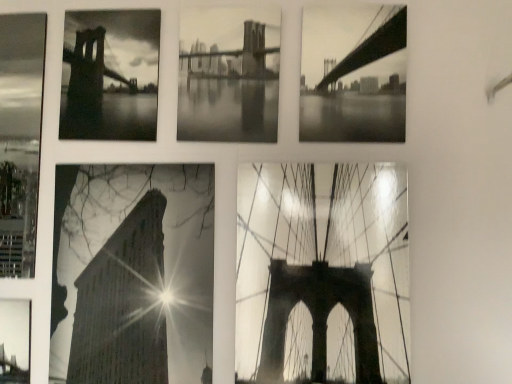
I want to click on monochrome paper brooklyn bridge at center, the fourth picture frame in the left-to-right sequence, so click(229, 74).

In order to face high contrast paper building at bottom left, the 4th picture frame in the right-to-left sequence, should I rotate leftwards or rightwards?

It's best to rotate left around 15.749 degrees.

I want to click on matte glass bridge at center, which is the 5th picture frame in left-to-right order, so click(x=322, y=273).

Identify the location of monochrome bridge at upper right, arranged as the 1th picture frame when viewed from the right. (354, 74).

Is matte glass bridge at center, which is the 5th picture frame in left-to-right order, facing away from monochrome paper brooklyn bridge at center, the fourth picture frame in the left-to-right sequence?

No, matte glass bridge at center, which is the 5th picture frame in left-to-right order,'s orientation is not away from monochrome paper brooklyn bridge at center, the fourth picture frame in the left-to-right sequence.

Between matte glass bridge at center, acting as the 2th picture frame starting from the right, and monochrome paper brooklyn bridge at center, the fourth picture frame in the left-to-right sequence, which one appears on the right side from the viewer's perspective?

matte glass bridge at center, acting as the 2th picture frame starting from the right.

Are matte glass bridge at center, acting as the 2th picture frame starting from the right, and monochrome paper brooklyn bridge at center, the fourth picture frame in the left-to-right sequence, beside each other?

matte glass bridge at center, acting as the 2th picture frame starting from the right, and monochrome paper brooklyn bridge at center, the fourth picture frame in the left-to-right sequence, are not in contact.

Which of these two, matte glass bridge at center, which is the 5th picture frame in left-to-right order, or monochrome paper brooklyn bridge at center, the fourth picture frame in the left-to-right sequence, is smaller?

With smaller size is monochrome paper brooklyn bridge at center, the fourth picture frame in the left-to-right sequence.

From the image's perspective, between metallic bridge at bottom left, which ranks as the first picture frame in left-to-right order, and monochrome bridge at upper right, arranged as the 1th picture frame when viewed from the right, which one is located above?

monochrome bridge at upper right, arranged as the 1th picture frame when viewed from the right, from the image's perspective.

Is metallic bridge at bottom left, which is the 6th picture frame in right-to-left order, completely or partially outside of monochrome bridge at upper right, arranged as the 1th picture frame when viewed from the right?

metallic bridge at bottom left, which is the 6th picture frame in right-to-left order, lies outside monochrome bridge at upper right, arranged as the 1th picture frame when viewed from the right,'s area.

Considering their positions, is metallic bridge at bottom left, which is the 6th picture frame in right-to-left order, located in front of or behind monochrome bridge at upper right, arranged as the 1th picture frame when viewed from the right?

Visually, metallic bridge at bottom left, which is the 6th picture frame in right-to-left order, is located behind monochrome bridge at upper right, arranged as the 1th picture frame when viewed from the right.

Is point (346, 64) positioned after point (226, 45)?

No, it is in front of (226, 45).

Is monochrome bridge at upper right, arranged as the 1th picture frame when viewed from the right, in front of or behind monochrome paper brooklyn bridge at center, marked as the 3th picture frame in a right-to-left arrangement, in the image?

Clearly, monochrome bridge at upper right, arranged as the 1th picture frame when viewed from the right, is in front of monochrome paper brooklyn bridge at center, marked as the 3th picture frame in a right-to-left arrangement.

Between monochrome bridge at upper right, arranged as the 1th picture frame when viewed from the right, and monochrome paper brooklyn bridge at center, marked as the 3th picture frame in a right-to-left arrangement, which one has smaller size?

Smaller between the two is monochrome bridge at upper right, arranged as the 1th picture frame when viewed from the right.

From the image's perspective, who appears lower, monochrome bridge at upper right, the sixth picture frame in the left-to-right sequence, or monochrome paper brooklyn bridge at center, marked as the 3th picture frame in a right-to-left arrangement?

monochrome bridge at upper right, the sixth picture frame in the left-to-right sequence, from the image's perspective.

From the image's perspective, which is below, matte glass bridge at center, acting as the 2th picture frame starting from the right, or monochrome bridge at upper left, positioned as the 5th picture frame in right-to-left order?

matte glass bridge at center, acting as the 2th picture frame starting from the right, is shown below in the image.

Which is behind, matte glass bridge at center, acting as the 2th picture frame starting from the right, or monochrome bridge at upper left, positioned as the 5th picture frame in right-to-left order?

Positioned behind is monochrome bridge at upper left, positioned as the 5th picture frame in right-to-left order.

Consider the image. Does matte glass bridge at center, which is the 5th picture frame in left-to-right order, have a smaller size compared to monochrome bridge at upper left, which is the 2th picture frame in left-to-right order?

No.

Between metallic bridge at bottom left, which is the 6th picture frame in right-to-left order, and monochrome bridge at upper left, positioned as the 5th picture frame in right-to-left order, which one has smaller size?

With smaller size is metallic bridge at bottom left, which is the 6th picture frame in right-to-left order.

How far apart are metallic bridge at bottom left, which ranks as the first picture frame in left-to-right order, and monochrome bridge at upper left, which is the 2th picture frame in left-to-right order?

metallic bridge at bottom left, which ranks as the first picture frame in left-to-right order, is 22.25 inches away from monochrome bridge at upper left, which is the 2th picture frame in left-to-right order.

From the image's perspective, which object appears higher, metallic bridge at bottom left, which is the 6th picture frame in right-to-left order, or monochrome bridge at upper left, positioned as the 5th picture frame in right-to-left order?

monochrome bridge at upper left, positioned as the 5th picture frame in right-to-left order, appears higher in the image.

Can you confirm if metallic bridge at bottom left, which ranks as the first picture frame in left-to-right order, is positioned to the left of monochrome bridge at upper left, positioned as the 5th picture frame in right-to-left order?

Yes.

In the scene shown: Could you measure the distance between high contrast paper building at bottom left, the 4th picture frame in the right-to-left sequence, and metallic bridge at bottom left, which ranks as the first picture frame in left-to-right order?

high contrast paper building at bottom left, the 4th picture frame in the right-to-left sequence, and metallic bridge at bottom left, which ranks as the first picture frame in left-to-right order, are 10.20 inches apart from each other.

Does high contrast paper building at bottom left, the 4th picture frame in the right-to-left sequence, have a larger size compared to metallic bridge at bottom left, which is the 6th picture frame in right-to-left order?

Indeed, high contrast paper building at bottom left, the 4th picture frame in the right-to-left sequence, has a larger size compared to metallic bridge at bottom left, which is the 6th picture frame in right-to-left order.

Could you tell me if high contrast paper building at bottom left, the 4th picture frame in the right-to-left sequence, is facing metallic bridge at bottom left, which is the 6th picture frame in right-to-left order?

No, high contrast paper building at bottom left, the 4th picture frame in the right-to-left sequence, is not turned towards metallic bridge at bottom left, which is the 6th picture frame in right-to-left order.

From a real-world perspective, does high contrast paper building at bottom left, the 3th picture frame in the left-to-right sequence, sit lower than metallic bridge at bottom left, which ranks as the first picture frame in left-to-right order?

No, from a real-world perspective, high contrast paper building at bottom left, the 3th picture frame in the left-to-right sequence, is not under metallic bridge at bottom left, which ranks as the first picture frame in left-to-right order.

Between high contrast paper building at bottom left, the 4th picture frame in the right-to-left sequence, and monochrome bridge at upper left, which is the 2th picture frame in left-to-right order, which one is positioned in front?

Positioned in front is high contrast paper building at bottom left, the 4th picture frame in the right-to-left sequence.

How far apart are high contrast paper building at bottom left, the 3th picture frame in the left-to-right sequence, and monochrome bridge at upper left, positioned as the 5th picture frame in right-to-left order?

high contrast paper building at bottom left, the 3th picture frame in the left-to-right sequence, is 11.29 inches away from monochrome bridge at upper left, positioned as the 5th picture frame in right-to-left order.

Would you say high contrast paper building at bottom left, the 4th picture frame in the right-to-left sequence, is outside monochrome bridge at upper left, positioned as the 5th picture frame in right-to-left order?

Yes, high contrast paper building at bottom left, the 4th picture frame in the right-to-left sequence, is not within monochrome bridge at upper left, positioned as the 5th picture frame in right-to-left order.

Which object is positioned more to the left, high contrast paper building at bottom left, the 4th picture frame in the right-to-left sequence, or monochrome bridge at upper left, which is the 2th picture frame in left-to-right order?

From the viewer's perspective, monochrome bridge at upper left, which is the 2th picture frame in left-to-right order, appears more on the left side.

At what (x,y) coordinates should I click in order to perform the action: click on the 1st picture frame to the left when counting from the matte glass bridge at center, which is the 5th picture frame in left-to-right order. Please return your answer as a coordinate pair (x, y). The width and height of the screenshot is (512, 384). Looking at the image, I should click on (229, 74).

The width and height of the screenshot is (512, 384). Identify the location of the 5th picture frame positioned below the monochrome bridge at upper right, the sixth picture frame in the left-to-right sequence (from a real-world perspective). (15, 341).

Estimate the real-world distances between objects in this image. Which object is closer to monochrome bridge at upper left, positioned as the 5th picture frame in right-to-left order, monochrome paper brooklyn bridge at center, marked as the 3th picture frame in a right-to-left arrangement, or high contrast paper building at bottom left, the 3th picture frame in the left-to-right sequence?

Among the two, monochrome paper brooklyn bridge at center, marked as the 3th picture frame in a right-to-left arrangement, is located nearer to monochrome bridge at upper left, positioned as the 5th picture frame in right-to-left order.

Based on their spatial positions, is metallic bridge at bottom left, which ranks as the first picture frame in left-to-right order, or monochrome bridge at upper right, arranged as the 1th picture frame when viewed from the right, further from monochrome paper brooklyn bridge at center, the fourth picture frame in the left-to-right sequence?

Based on the image, metallic bridge at bottom left, which ranks as the first picture frame in left-to-right order, appears to be further to monochrome paper brooklyn bridge at center, the fourth picture frame in the left-to-right sequence.

Which object lies nearer to the anchor point matte glass bridge at center, acting as the 2th picture frame starting from the right, high contrast paper building at bottom left, the 3th picture frame in the left-to-right sequence, or monochrome bridge at upper left, positioned as the 5th picture frame in right-to-left order?

high contrast paper building at bottom left, the 3th picture frame in the left-to-right sequence, is positioned closer to the anchor matte glass bridge at center, acting as the 2th picture frame starting from the right.

Which object lies further to the anchor point metallic bridge at bottom left, which is the 6th picture frame in right-to-left order, monochrome bridge at upper right, the sixth picture frame in the left-to-right sequence, or high contrast paper building at bottom left, the 3th picture frame in the left-to-right sequence?

Based on the image, monochrome bridge at upper right, the sixth picture frame in the left-to-right sequence, appears to be further to metallic bridge at bottom left, which is the 6th picture frame in right-to-left order.

Which object lies further to the anchor point monochrome paper brooklyn bridge at center, the fourth picture frame in the left-to-right sequence, monochrome bridge at upper left, which is the 2th picture frame in left-to-right order, or monochrome bridge at upper right, arranged as the 1th picture frame when viewed from the right?

monochrome bridge at upper right, arranged as the 1th picture frame when viewed from the right.

From the image, which object appears to be nearer to monochrome bridge at upper right, the sixth picture frame in the left-to-right sequence, matte glass bridge at center, which is the 5th picture frame in left-to-right order, or high contrast paper building at bottom left, the 4th picture frame in the right-to-left sequence?

matte glass bridge at center, which is the 5th picture frame in left-to-right order, lies closer to monochrome bridge at upper right, the sixth picture frame in the left-to-right sequence, than the other object.

Looking at this image, considering their positions, is monochrome paper brooklyn bridge at center, marked as the 3th picture frame in a right-to-left arrangement, positioned further to monochrome bridge at upper right, the sixth picture frame in the left-to-right sequence, than monochrome bridge at upper left, positioned as the 5th picture frame in right-to-left order?

monochrome bridge at upper left, positioned as the 5th picture frame in right-to-left order, is further to monochrome bridge at upper right, the sixth picture frame in the left-to-right sequence.

From the image, which object appears to be farther from high contrast paper building at bottom left, the 3th picture frame in the left-to-right sequence, monochrome bridge at upper right, arranged as the 1th picture frame when viewed from the right, or metallic bridge at bottom left, which ranks as the first picture frame in left-to-right order?

Result: Among the two, monochrome bridge at upper right, arranged as the 1th picture frame when viewed from the right, is located further to high contrast paper building at bottom left, the 3th picture frame in the left-to-right sequence.

This screenshot has height=384, width=512. Find the location of `picture frame between monochrome paper brooklyn bridge at center, marked as the 3th picture frame in a right-to-left arrangement, and matte glass bridge at center, which is the 5th picture frame in left-to-right order, from top to bottom`. picture frame between monochrome paper brooklyn bridge at center, marked as the 3th picture frame in a right-to-left arrangement, and matte glass bridge at center, which is the 5th picture frame in left-to-right order, from top to bottom is located at coordinates (354, 74).